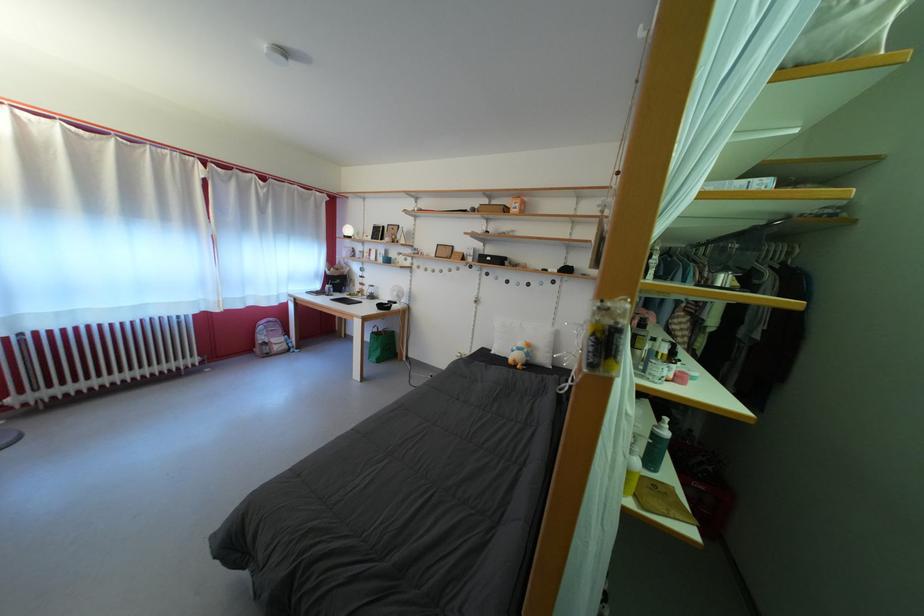
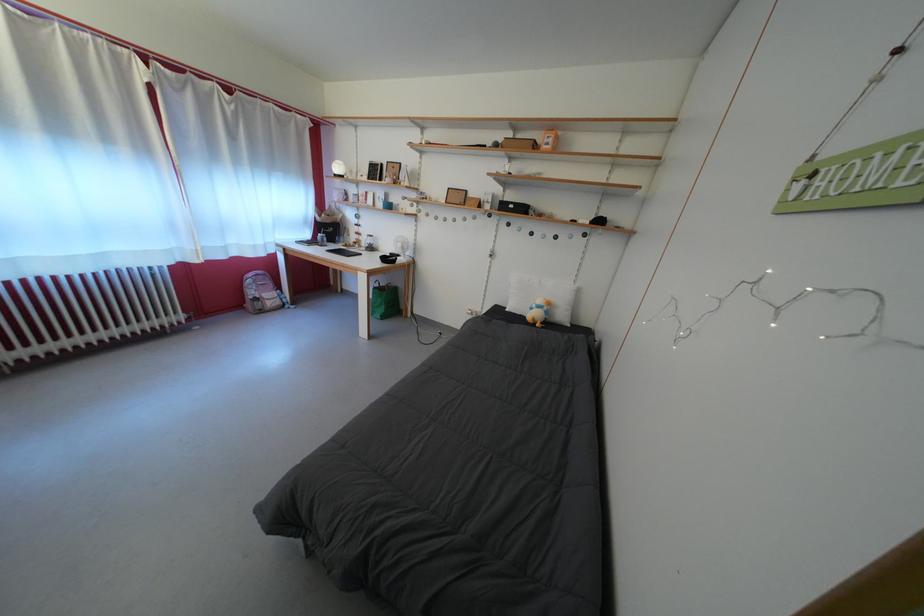
Question: I am providing you with two images of the same scene from different viewpoints. Which of the following objects are not visible in image2?

Choices:
 (A) green tote bag
 (B) white desk fan
 (C) round white lamp
 (D) none of these

Answer: (D)